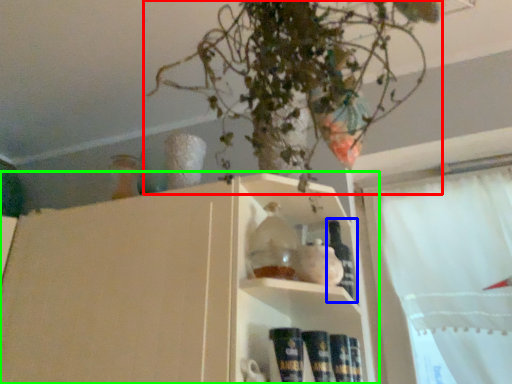
Question: Based on their relative distances, which object is farther from houseplant (highlighted by a red box)? Choose from bottle (highlighted by a blue box) and shelf (highlighted by a green box).

Choices:
 (A) bottle
 (B) shelf

Answer: (A)